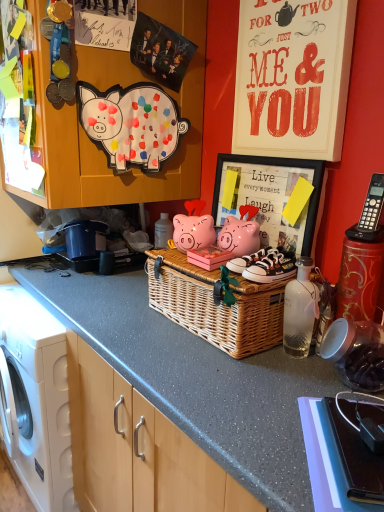
In order to click on free point above woven wicker basket at center (from a real-world perspective) in this screenshot , I will do `click(218, 254)`.